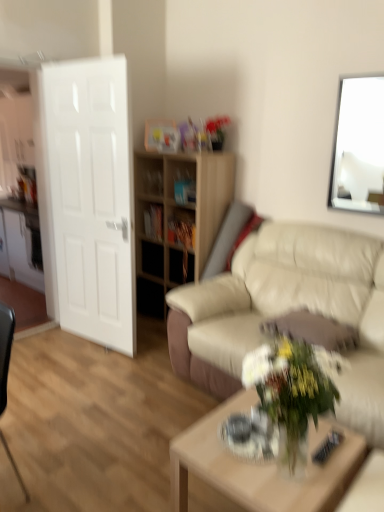
What do you see at coordinates (177, 219) in the screenshot? The width and height of the screenshot is (384, 512). I see `light wood shelf at center` at bounding box center [177, 219].

I want to click on white glossy door at left, so click(x=87, y=198).

Image resolution: width=384 pixels, height=512 pixels. Describe the element at coordinates (259, 467) in the screenshot. I see `light wood/texture coffee table at center` at that location.

What are the coordinates of `beige leather couch at center` in the screenshot? It's located at (287, 311).

You are a GUI agent. You are given a task and a screenshot of the screen. Output one action in this format:
    pyautogui.click(x=<x>, y=<y>)
    Task: Click on the white glossy picture frame at upper right
    The height and width of the screenshot is (512, 384).
    Given the screenshot: What is the action you would take?
    pyautogui.click(x=359, y=146)

You are a GUI agent. You are given a task and a screenshot of the screen. Output one action in this format:
    pyautogui.click(x=<x>, y=<y>)
    Task: Click on the light wood shelf at center
    This screenshot has width=384, height=512.
    Given the screenshot: What is the action you would take?
    pyautogui.click(x=177, y=219)

Can you tell me how much white glossy vase at lower center and white glossy picture frame at upper right differ in facing direction?

0.575 degrees separate the facing orientations of white glossy vase at lower center and white glossy picture frame at upper right.

Is white glossy vase at lower center positioned before white glossy picture frame at upper right?

Yes, white glossy vase at lower center is closer to the camera.

Can you confirm if white glossy vase at lower center is bigger than white glossy picture frame at upper right?

Correct, white glossy vase at lower center is larger in size than white glossy picture frame at upper right.

Considering the sizes of objects white glossy vase at lower center and white glossy picture frame at upper right in the image provided, who is thinner, white glossy vase at lower center or white glossy picture frame at upper right?

white glossy picture frame at upper right.

Does light wood/texture coffee table at center come behind beige leather couch at center?

No, light wood/texture coffee table at center is closer to the camera.

From the image's perspective, does light wood/texture coffee table at center appear higher than beige leather couch at center?

No.

From a real-world perspective, is light wood/texture coffee table at center positioned above or below beige leather couch at center?

light wood/texture coffee table at center is situated lower than beige leather couch at center in the real world.

Can you confirm if black matte drawer at center is bigger than light wood/texture coffee table at center?

No, black matte drawer at center is not bigger than light wood/texture coffee table at center.

Considering the points (144, 250) and (203, 445), which point is behind, point (144, 250) or point (203, 445)?

The point (144, 250) is farther from the camera.

Is black matte drawer at center to the left of light wood/texture coffee table at center from the viewer's perspective?

Indeed, black matte drawer at center is positioned on the left side of light wood/texture coffee table at center.

Is black matte drawer at center directly adjacent to light wood/texture coffee table at center?

No.

Between white glossy vase at lower center and beige leather couch at center, which one appears on the left side from the viewer's perspective?

Positioned to the left is white glossy vase at lower center.

Can you tell me how much white glossy vase at lower center and beige leather couch at center differ in facing direction?

white glossy vase at lower center and beige leather couch at center are facing 0.208 degrees away from each other.

Is white glossy vase at lower center with beige leather couch at center?

They are not placed beside each other.

In the scene shown: Does light wood/texture coffee table at center touch white glossy vase at lower center?

light wood/texture coffee table at center is not next to white glossy vase at lower center, and they're not touching.

Is light wood/texture coffee table at center looking in the opposite direction of white glossy vase at lower center?

No, white glossy vase at lower center is not at the back of light wood/texture coffee table at center.

From a real-world perspective, between light wood/texture coffee table at center and white glossy vase at lower center, who is vertically higher?

white glossy vase at lower center.

Is the depth of light wood/texture coffee table at center greater than that of white glossy vase at lower center?

Yes.

Locate an element on the screen. Image resolution: width=384 pixels, height=512 pixels. houseplant on the right of light wood shelf at center is located at coordinates (293, 388).

From the image's perspective, between light wood shelf at center and white glossy vase at lower center, who is located below?

white glossy vase at lower center, from the image's perspective.

Would you say light wood shelf at center is outside white glossy vase at lower center?

Absolutely, light wood shelf at center is external to white glossy vase at lower center.

How different are the orientations of light wood shelf at center and white glossy vase at lower center in degrees?

There is a 0.553-degree angle between the facing directions of light wood shelf at center and white glossy vase at lower center.

Which object is positioned more to the right, white glossy door at left or white glossy picture frame at upper right?

white glossy picture frame at upper right.

Is white glossy door at left facing away from white glossy picture frame at upper right?

No.

Is point (92, 301) closer or farther from the camera than point (352, 181)?

Point (92, 301).

In the scene shown: From a real-world perspective, is white glossy door at left positioned above or below white glossy picture frame at upper right?

From a real-world perspective, white glossy door at left is physically below white glossy picture frame at upper right.

At what (x,y) coordinates should I click in order to perform the action: click on picture frame that appears above the white glossy vase at lower center (from a real-world perspective). Please return your answer as a coordinate pair (x, y). The image size is (384, 512). Looking at the image, I should click on (359, 146).

In order to click on studio couch on the right of light wood/texture coffee table at center in this screenshot , I will do `click(287, 311)`.

Based on their spatial positions, is white glossy picture frame at upper right or black matte drawer at center closer to light wood shelf at center?

black matte drawer at center.

Looking at the image, which one is located further to light wood shelf at center, light wood/texture coffee table at center or white glossy vase at lower center?

Among the two, white glossy vase at lower center is located further to light wood shelf at center.

Looking at the image, which one is located closer to black matte drawer at center, light wood/texture coffee table at center or white glossy door at left?

white glossy door at left lies closer to black matte drawer at center than the other object.

Which object lies further to the anchor point white glossy door at left, white glossy picture frame at upper right or light wood shelf at center?

white glossy picture frame at upper right.

In the scene shown: When comparing their distances from white glossy picture frame at upper right, does white glossy door at left or white glossy vase at lower center seem further?

white glossy vase at lower center lies further to white glossy picture frame at upper right than the other object.

Which object lies nearer to the anchor point white glossy vase at lower center, white glossy door at left or white glossy picture frame at upper right?

white glossy picture frame at upper right.

Based on their spatial positions, is black matte drawer at center or light wood/texture coffee table at center further from light wood shelf at center?

light wood/texture coffee table at center is positioned further to the anchor light wood shelf at center.

Based on their spatial positions, is white glossy door at left or white glossy door at left further from beige leather couch at center?

white glossy door at left.

Identify the location of studio couch that lies between white glossy picture frame at upper right and white glossy vase at lower center from top to bottom. The width and height of the screenshot is (384, 512). (287, 311).

Where is `coffee table situated between white glossy door at left and beige leather couch at center from left to right`? This screenshot has height=512, width=384. coffee table situated between white glossy door at left and beige leather couch at center from left to right is located at coordinates (259, 467).

The height and width of the screenshot is (512, 384). In order to click on studio couch between white glossy door at left and white glossy picture frame at upper right in this screenshot , I will do `click(287, 311)`.

In order to click on entertainment center between light wood/texture coffee table at center and light wood shelf at center from front to back in this screenshot , I will do `click(37, 192)`.